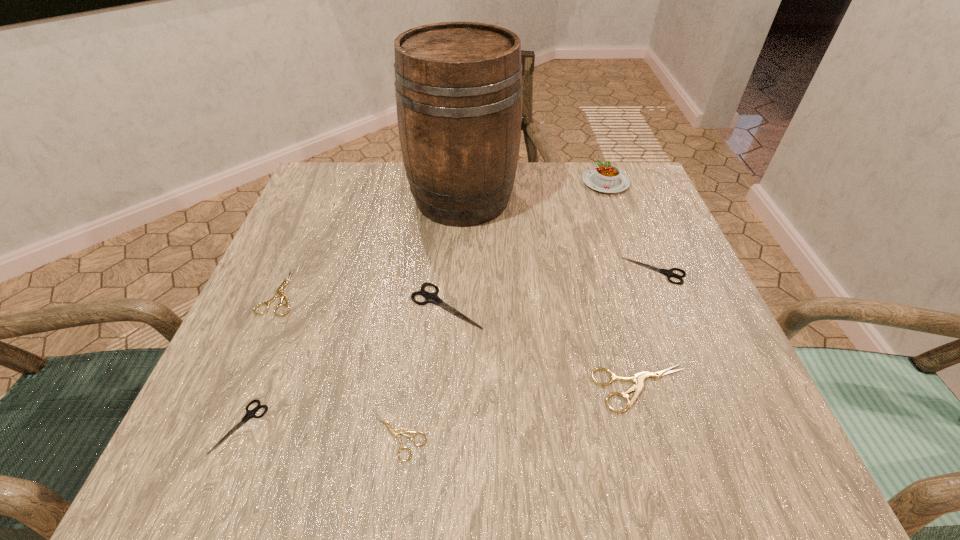
Identify the location of cider that is at the far edge. (458, 85).

Where is `pudding that is at the far edge`? The width and height of the screenshot is (960, 540). pudding that is at the far edge is located at coordinates (607, 178).

The height and width of the screenshot is (540, 960). What are the coordinates of `pudding situated at the right edge` in the screenshot? It's located at (607, 178).

At what (x,y) coordinates should I click in order to perform the action: click on object at the near left corner. Please return your answer as a coordinate pair (x, y). This screenshot has width=960, height=540. Looking at the image, I should click on [249, 414].

Find the location of a particular element. This screenshot has height=540, width=960. object positioned at the far right corner is located at coordinates (607, 178).

Locate an element on the screen. The width and height of the screenshot is (960, 540). object that is at the near right corner is located at coordinates (638, 378).

You are a GUI agent. You are given a task and a screenshot of the screen. Output one action in this format:
    pyautogui.click(x=<x>, y=<y>)
    Task: Click on the free space at the far edge of the desktop
    This screenshot has width=960, height=540.
    Given the screenshot: What is the action you would take?
    pyautogui.click(x=398, y=195)

Find the location of `vacant point at the near edge`. vacant point at the near edge is located at coordinates (531, 465).

Image resolution: width=960 pixels, height=540 pixels. I want to click on free spot at the left edge of the desktop, so click(x=270, y=288).

In the image, there is a desktop. Identify the location of vacant space at the right edge. (614, 269).